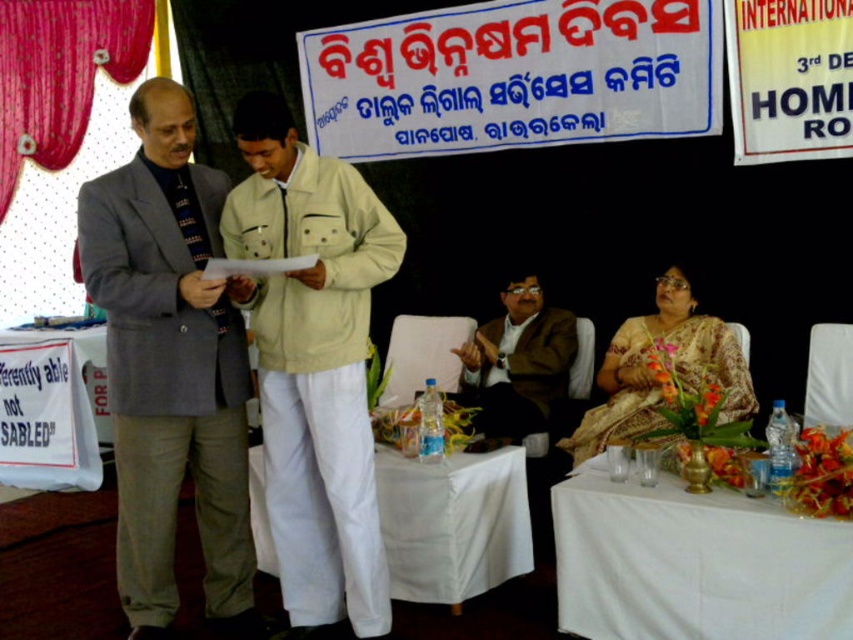
Does beige fabric jacket at center have a lesser height compared to brown textured suit at center?

No.

Can you confirm if beige fabric jacket at center is taller than brown textured suit at center?

Indeed, beige fabric jacket at center has a greater height compared to brown textured suit at center.

The image size is (853, 640). Find the location of `beige fabric jacket at center`. beige fabric jacket at center is located at coordinates point(312,364).

Does white cloth table at lower right have a larger size compared to white cloth-covered table at center?

Yes, white cloth table at lower right is bigger than white cloth-covered table at center.

Between white cloth table at lower right and white cloth-covered table at center, which one has more height?

white cloth-covered table at center

Is point (631, 552) farther from camera compared to point (520, 496)?

No, (631, 552) is in front of (520, 496).

Locate an element on the screen. The height and width of the screenshot is (640, 853). white cloth table at lower right is located at coordinates (694, 563).

Does gray woolen suit at left have a lesser width compared to brown textured suit at center?

Yes, gray woolen suit at left is thinner than brown textured suit at center.

Who is more forward, (x=132, y=568) or (x=476, y=364)?

Point (x=132, y=568) is in front.

Find the location of a particular element. Image resolution: width=853 pixels, height=640 pixels. gray woolen suit at left is located at coordinates 170,368.